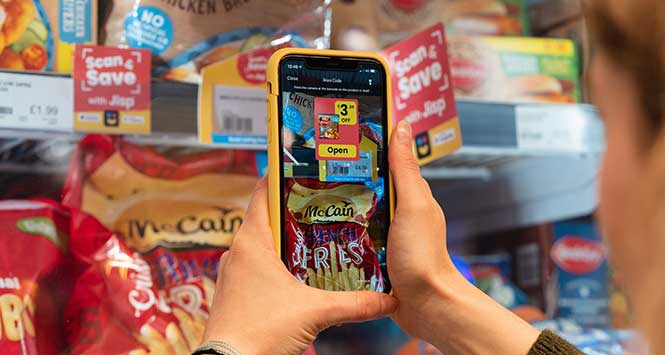
Locate an element on the screen. brown box is located at coordinates (192, 23).